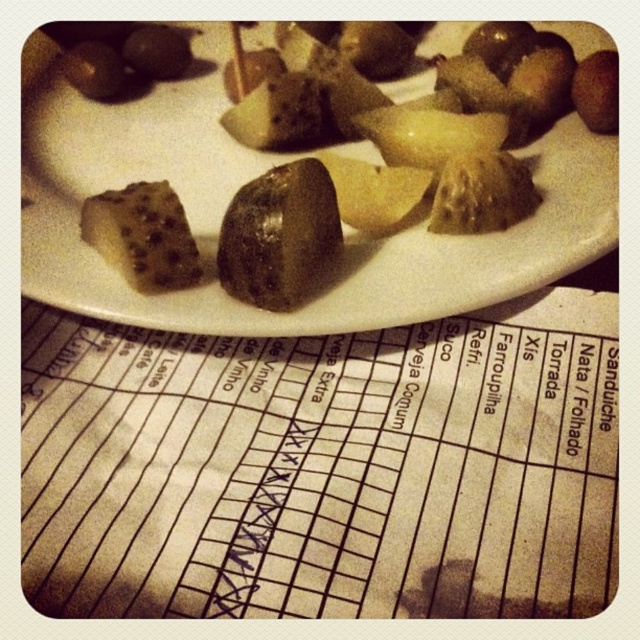
What do you see at coordinates (253, 177) in the screenshot?
I see `greenish-yellow pickled at upper center` at bounding box center [253, 177].

Is greenish-yellow pickled at upper center to the left of green glossy pickle at center from the viewer's perspective?

No, greenish-yellow pickled at upper center is not to the left of green glossy pickle at center.

Which is in front, point (26, 124) or point (268, 172)?

Point (268, 172)

Find the location of a particular element. Image resolution: width=640 pixels, height=640 pixels. greenish-yellow pickled at upper center is located at coordinates (253, 177).

Who is positioned more to the right, green glossy pickle at center or green matte olive at center?

From the viewer's perspective, green glossy pickle at center appears more on the right side.

The height and width of the screenshot is (640, 640). Describe the element at coordinates (278, 236) in the screenshot. I see `green glossy pickle at center` at that location.

At what (x,y) coordinates should I click in order to perform the action: click on green glossy pickle at center. Please return your answer as a coordinate pair (x, y). The image size is (640, 640). Looking at the image, I should click on (278, 236).

Does point (145, 285) lie behind point (161, 42)?

That is False.

Which is in front, point (189, 253) or point (170, 56)?

Positioned in front is point (189, 253).

Does point (116, 252) come closer to viewer compared to point (168, 54)?

Yes, point (116, 252) is in front of point (168, 54).

Where is `green matte olive at center`? The width and height of the screenshot is (640, 640). green matte olive at center is located at coordinates (141, 236).